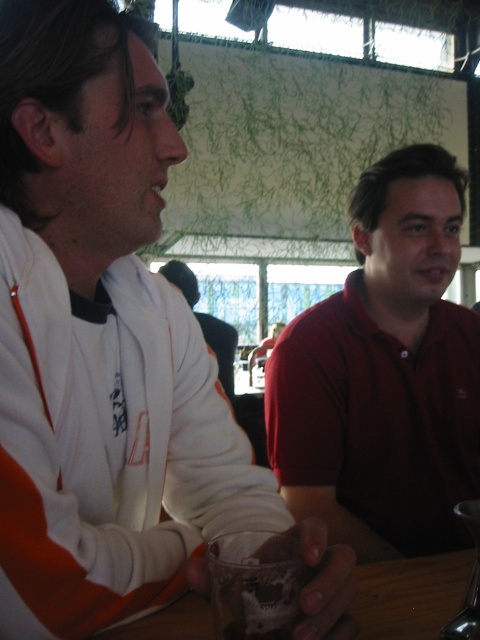
Can you confirm if matte red shirt at right is positioned to the right of matte white shirt at center?

Indeed, matte red shirt at right is positioned on the right side of matte white shirt at center.

Between matte red shirt at right and matte white shirt at center, which one appears on the left side from the viewer's perspective?

From the viewer's perspective, matte white shirt at center appears more on the left side.

Which is behind, point (336, 352) or point (232, 369)?

The point (232, 369) is more distant.

Identify the location of matte red shirt at right. Image resolution: width=480 pixels, height=640 pixels. (384, 372).